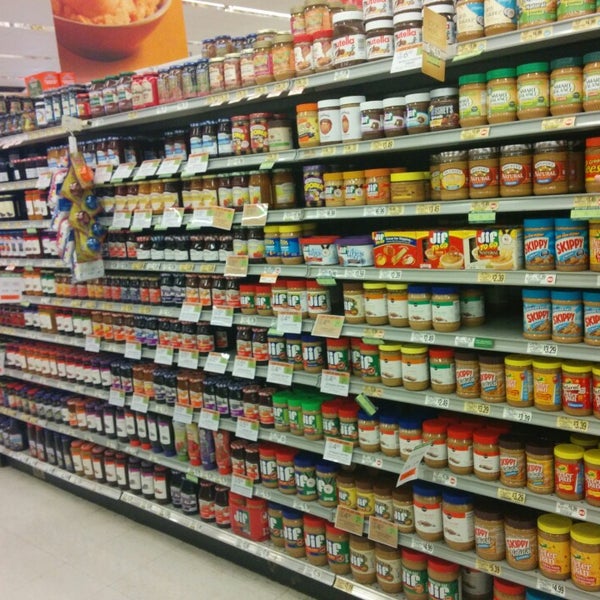
At what (x,y) coordinates should I click in order to perform the action: click on box. Please return your answer as a coordinate pair (x, y). Looking at the image, I should click on (528, 232), (497, 247), (454, 247), (399, 253).